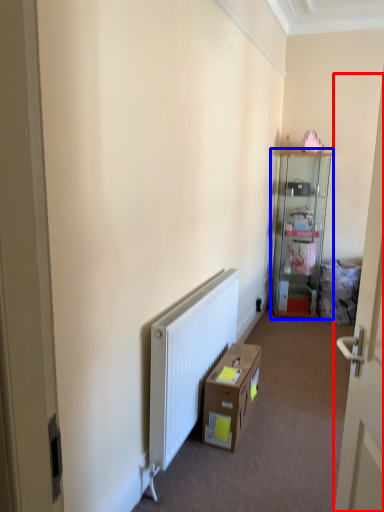
Question: Among these objects, which one is farthest to the camera, door (highlighted by a red box) or cabinetry (highlighted by a blue box)?

Choices:
 (A) door
 (B) cabinetry

Answer: (B)